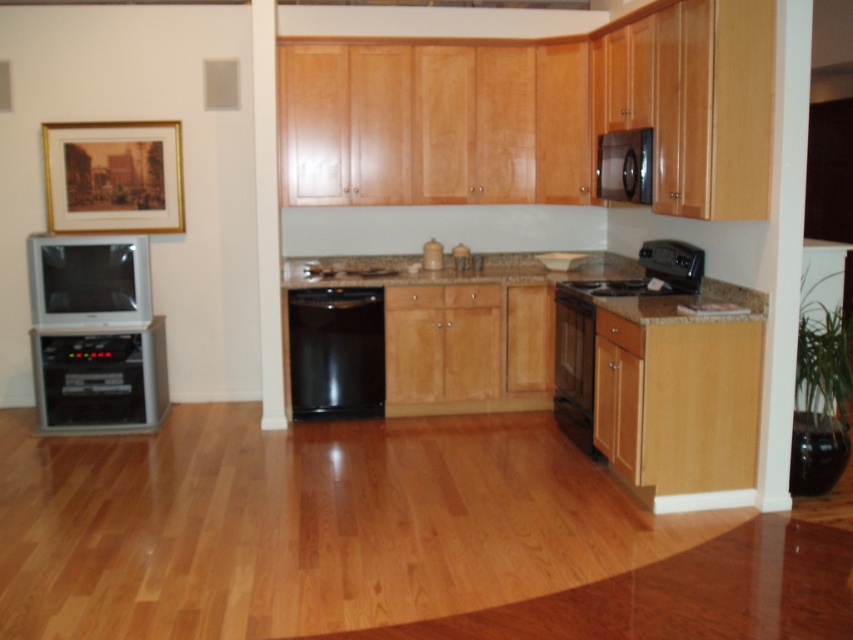
Is black glossy dishwasher at center in front of black glass oven at lower center?

That is False.

Between black glossy dishwasher at center and black glass oven at lower center, which one is positioned higher?

Positioned higher is black glossy dishwasher at center.

Between point (328, 339) and point (555, 317), which one is positioned behind?

Point (328, 339)

At what (x,y) coordinates should I click in order to perform the action: click on black glossy dishwasher at center. Please return your answer as a coordinate pair (x, y). This screenshot has height=640, width=853. Looking at the image, I should click on (335, 353).

Can you confirm if black glossy dishwasher at center is positioned above matte silver television at left?

No.

Is point (294, 401) positioned in front of point (140, 262)?

No, (294, 401) is further to viewer.

Identify the location of black glossy dishwasher at center. This screenshot has width=853, height=640. (335, 353).

Where is `metallic silver stereo at left`? The image size is (853, 640). metallic silver stereo at left is located at coordinates (100, 380).

Which is in front, point (125, 401) or point (137, 282)?

Point (137, 282) is in front.

Identify the location of metallic silver stereo at left. The image size is (853, 640). (100, 380).